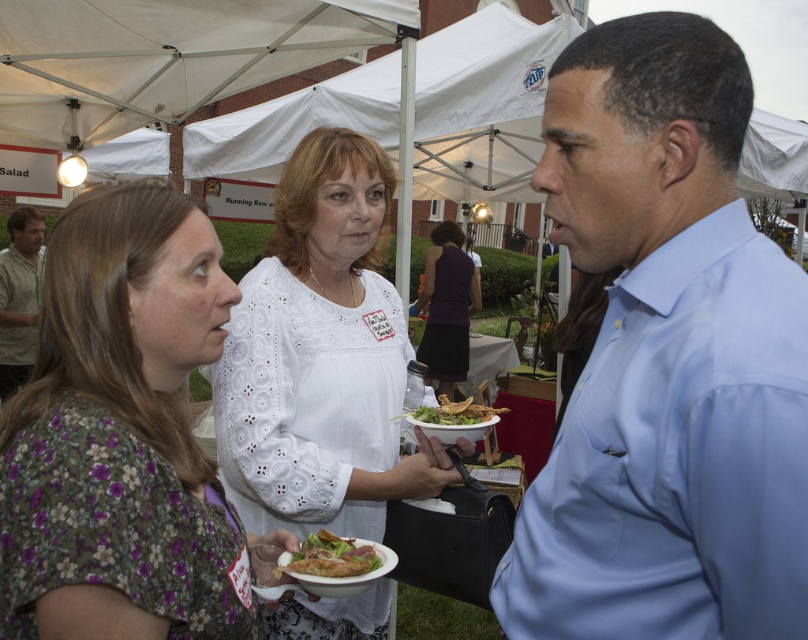
You are organizing a photo shoot and need to ensure that the light blue shirt at right and the green leafy salad with crispy bacon at center are visible in the frame. Based on their sizes, which object should you prioritize positioning closer to the camera to avoid being overshadowed?

The green leafy salad with crispy bacon at center should be positioned closer to the camera since the light blue shirt at right might be wider than it, potentially blocking its view if not properly framed.

You are a photographer at the event and want to capture both the floral fabric dress at center and the white lace blouse at center in a single photo. Since the camera can only focus on one subject at a time, which clothing item should you focus on to ensure the other is still visible but slightly blurred?

The floral fabric dress at center is in front of the white lace blouse at center, so focusing on the floral fabric dress at center will keep it sharp while the white lace blouse at center appears slightly blurred in the background.